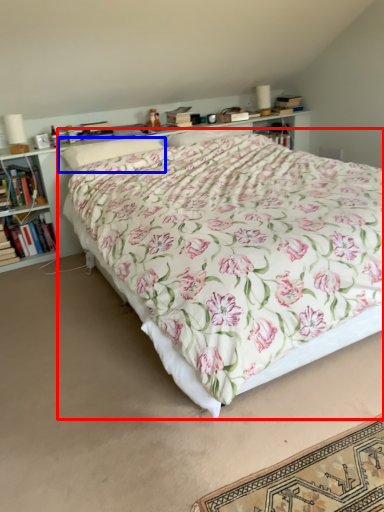
Question: Which of the following is the closest to the observer, bed (highlighted by a red box) or pillow (highlighted by a blue box)?

Choices:
 (A) bed
 (B) pillow

Answer: (A)